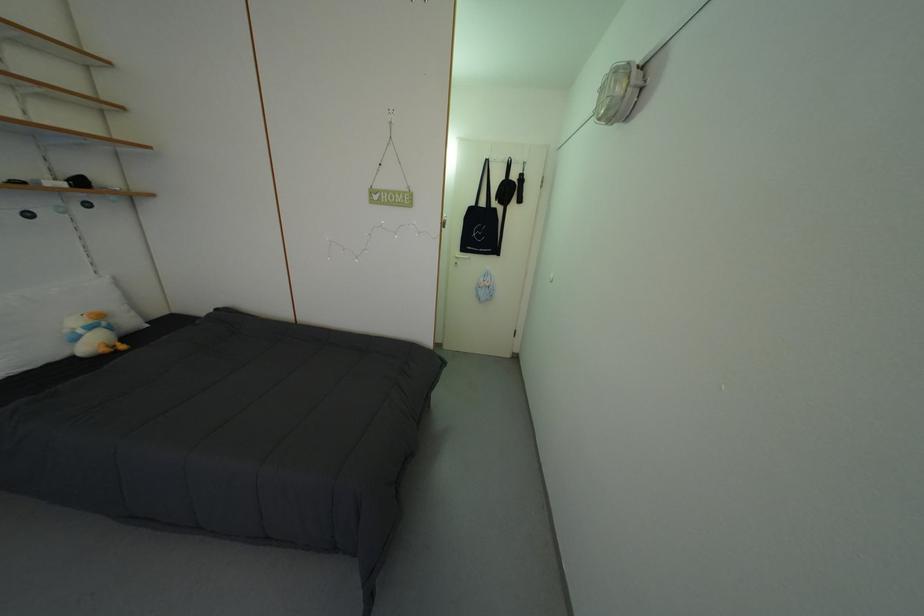
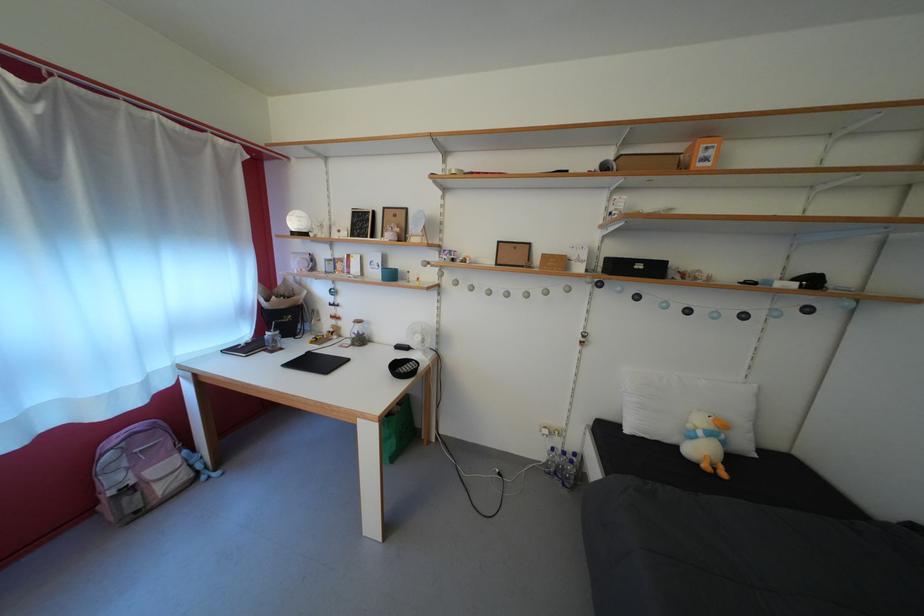
Find the pixel in the second image that matches (x=217, y=321) in the first image.

(897, 530)